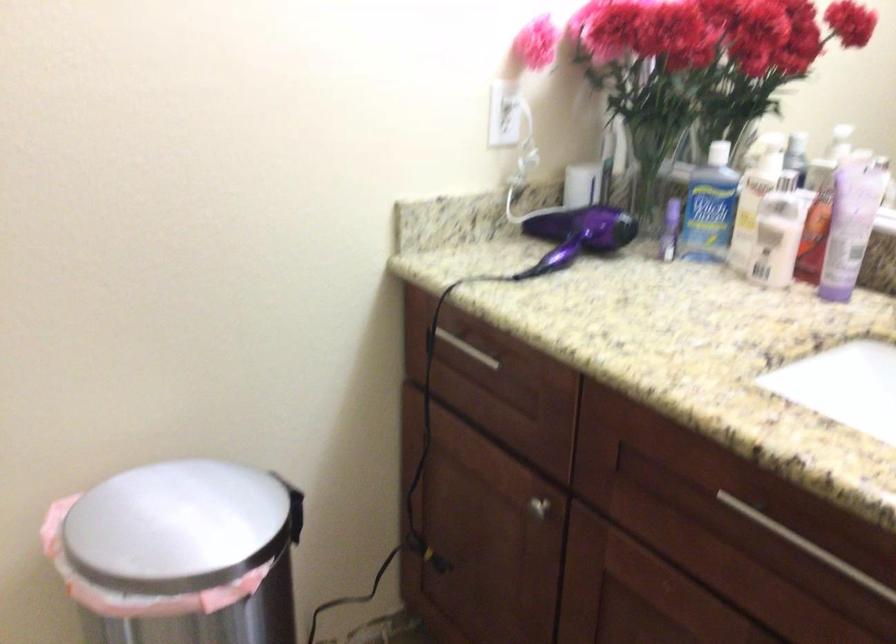
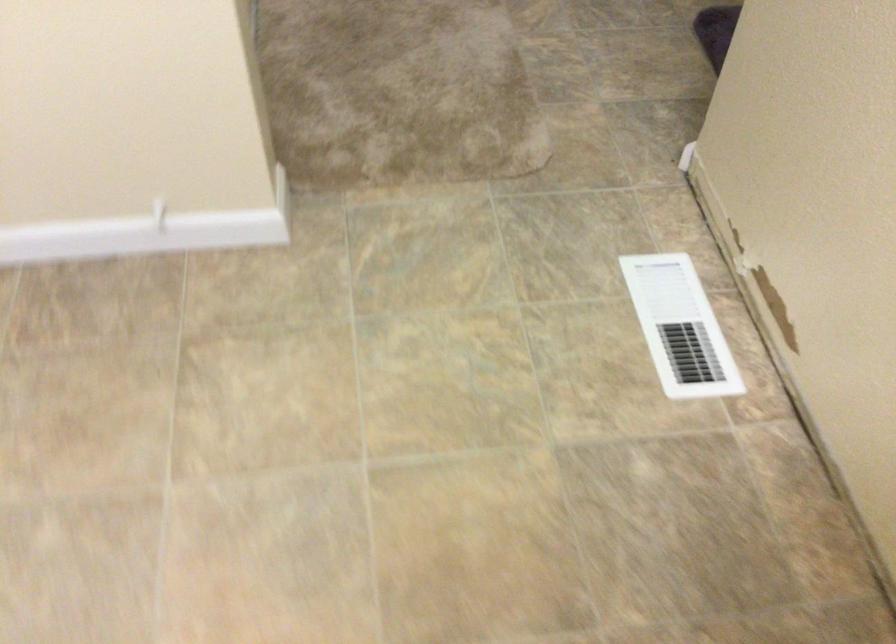
The first image is from the beginning of the video and the second image is from the end. How did the camera likely rotate when shooting the video?

The camera rotated toward left-down.